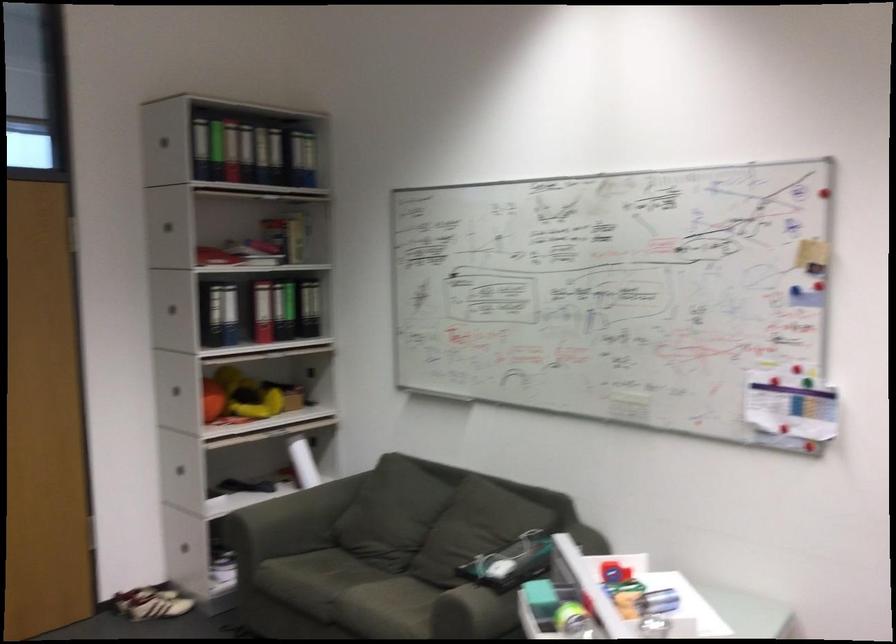
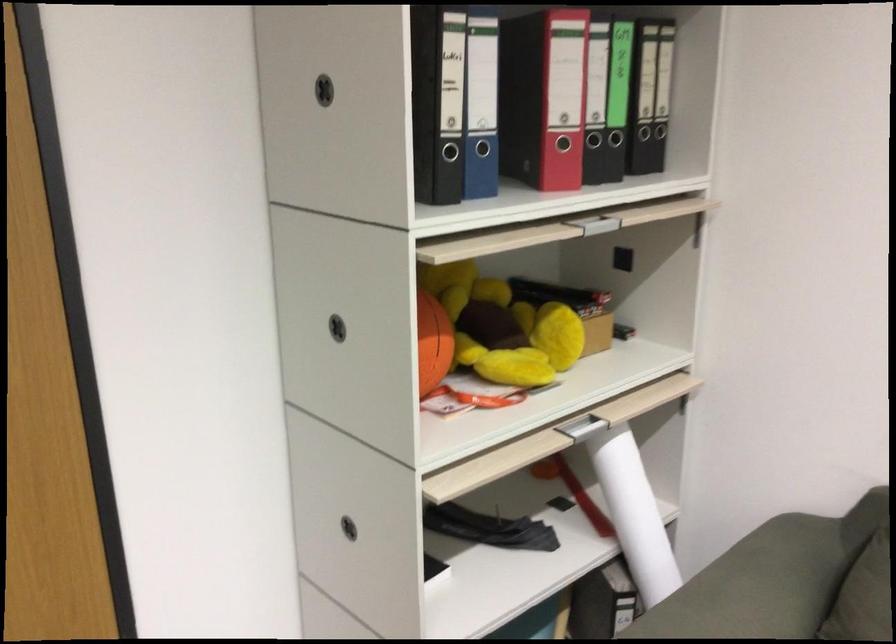
Where in the second image is the point corresponding to point 304,484 from the first image?

(633, 514)